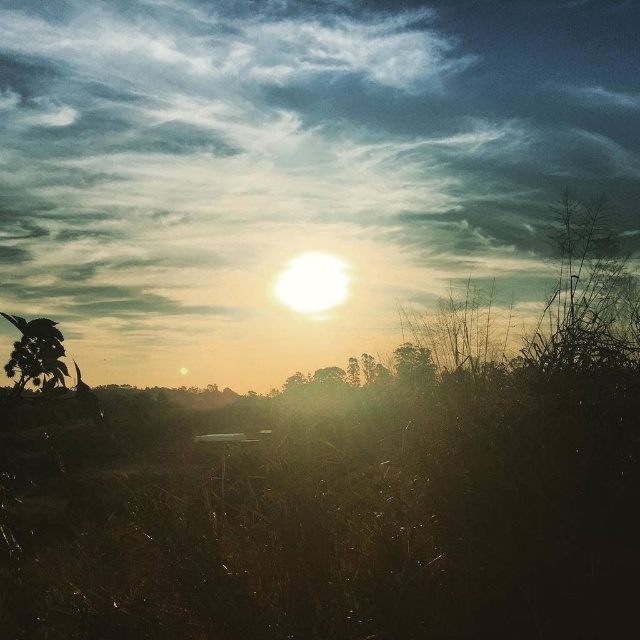
Can you confirm if green leafy tree at lower left is bigger than green matte tree at right?

No.

Who is taller, green leafy tree at lower left or green matte tree at right?

Standing taller between the two is green leafy tree at lower left.

Is point (3, 317) closer to camera compared to point (422, 362)?

Yes.

Locate an element on the screen. Image resolution: width=640 pixels, height=640 pixels. green leafy tree at lower left is located at coordinates (35, 355).